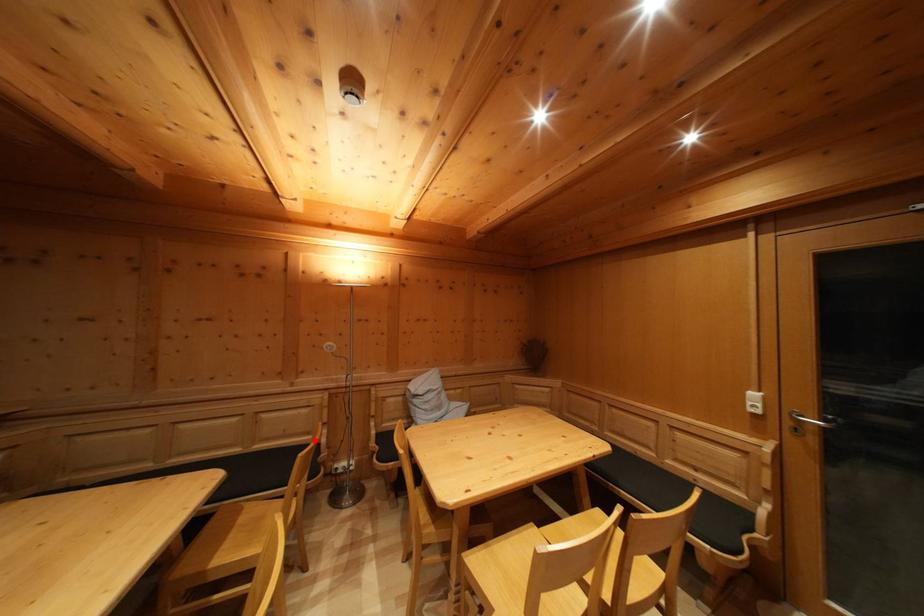
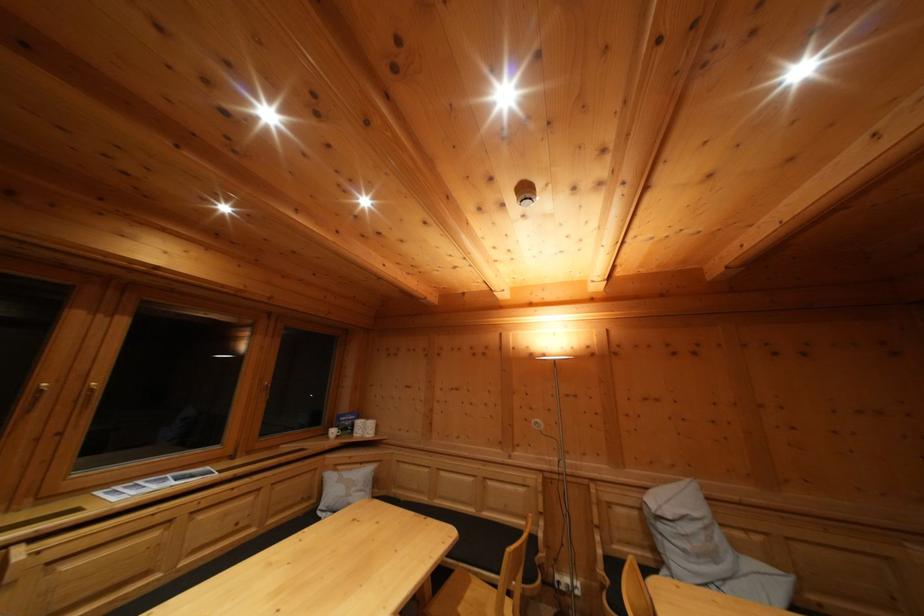
Question: I am providing you with two images of the same scene from different viewpoints. Given a red point in image1, look at the same physical point in image2. Is it:

Choices:
 (A) Closer to the viewpoint
 (B) Farther from the viewpoint

Answer: (B)